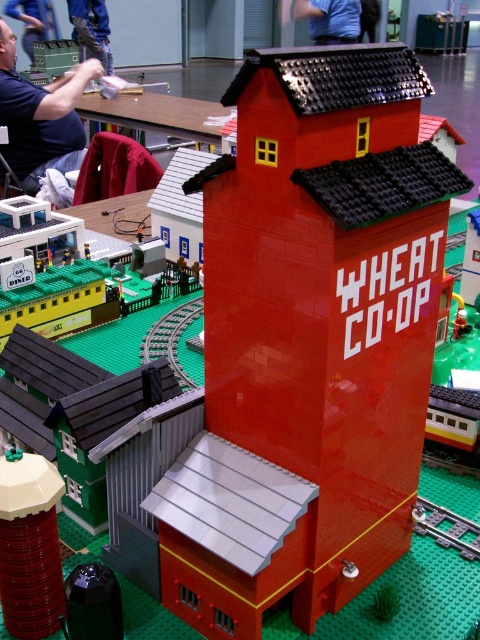
Question: Is blue shirt at upper left bigger than blue fabric shirt at upper center?

Choices:
 (A) no
 (B) yes

Answer: (A)

Question: Which point is farther to the camera?

Choices:
 (A) blue fabric shirt at upper center
 (B) blue shirt at upper left

Answer: (A)

Question: Does blue shirt at upper left have a greater width compared to blue fabric shirt at upper center?

Choices:
 (A) yes
 (B) no

Answer: (B)

Question: Which point is closer to the camera taking this photo?

Choices:
 (A) (301, 13)
 (B) (11, 58)

Answer: (B)

Question: Which of the following is the closest to the observer?

Choices:
 (A) (351, 12)
 (B) (13, 138)

Answer: (B)

Question: Is blue shirt at upper left bigger than blue fabric shirt at upper center?

Choices:
 (A) yes
 (B) no

Answer: (B)